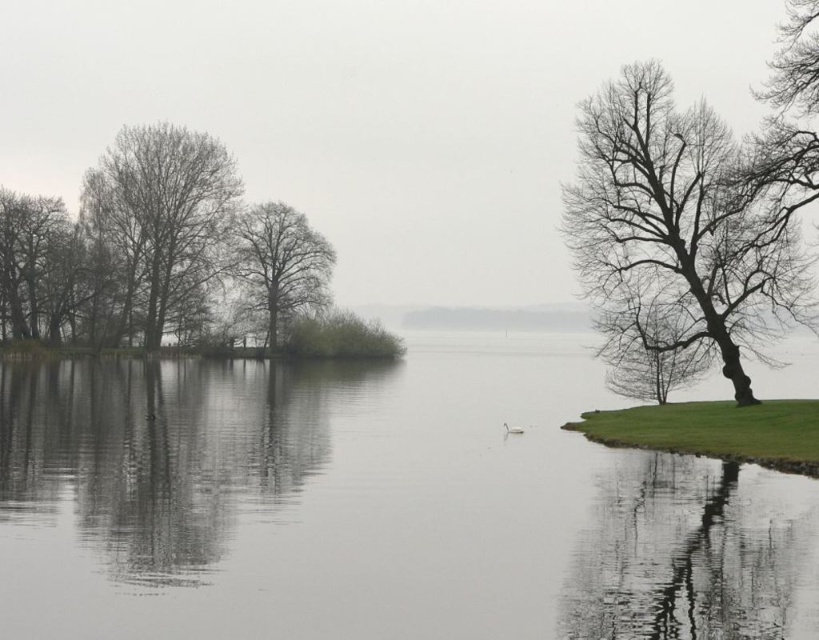
Who is shorter, bare branches tree at right or bare wood trees at left?

With less height is bare branches tree at right.

Is point (732, 378) more distant than point (148, 285)?

No, (732, 378) is closer to viewer.

Locate an element on the screen. bare branches tree at right is located at coordinates (676, 230).

Can you confirm if bare wood trees at left is positioned above brown textured tree at left?

Yes.

Is bare wood trees at left further to camera compared to brown textured tree at left?

Yes, bare wood trees at left is behind brown textured tree at left.

Describe the element at coordinates (164, 218) in the screenshot. This screenshot has width=819, height=640. I see `bare wood trees at left` at that location.

Identify the location of bare wood trees at left. The width and height of the screenshot is (819, 640). (164, 218).

Describe the element at coordinates (278, 262) in the screenshot. The image size is (819, 640). I see `bare wood tree at center` at that location.

Does bare wood tree at center appear on the right side of brown textured tree at left?

Correct, you'll find bare wood tree at center to the right of brown textured tree at left.

Between point (324, 300) and point (39, 240), which one is positioned in front?

Point (39, 240) is in front.

Find the location of a particular element. This screenshot has width=819, height=640. bare wood tree at center is located at coordinates (278, 262).